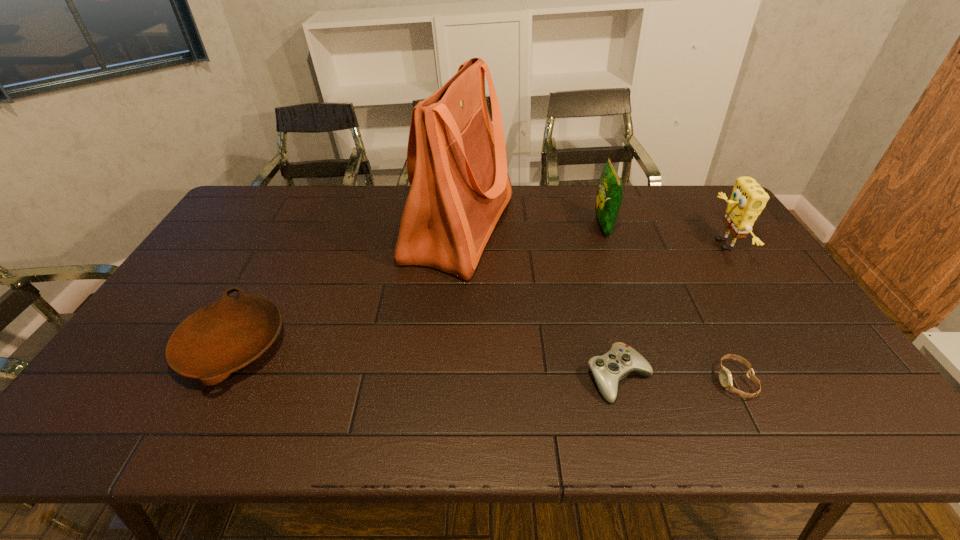
I want to click on shopping bag at the far edge, so click(x=456, y=159).

Identify the location of sponge that is at the far edge. Image resolution: width=960 pixels, height=540 pixels. (748, 199).

This screenshot has height=540, width=960. In order to click on crisp (potato chip) that is at the far edge in this screenshot , I will do `click(610, 190)`.

At what (x,y) coordinates should I click in order to perform the action: click on control that is positioned at the near edge. Please return your answer as a coordinate pair (x, y). Looking at the image, I should click on (608, 369).

Identify the location of watch present at the near edge. This screenshot has height=540, width=960. (725, 377).

This screenshot has height=540, width=960. Identify the location of object present at the left edge. pos(220,338).

You are a GUI agent. You are given a task and a screenshot of the screen. Output one action in this format:
    pyautogui.click(x=<x>, y=<y>)
    Task: Click on the object positioned at the right edge
    This screenshot has width=960, height=540.
    Given the screenshot: What is the action you would take?
    pyautogui.click(x=748, y=199)

I want to click on object that is at the far right corner, so click(x=748, y=199).

Locate an element on the screen. vacant space at the far edge of the desktop is located at coordinates (390, 200).

The width and height of the screenshot is (960, 540). I want to click on vacant region at the near edge of the desktop, so click(x=520, y=427).